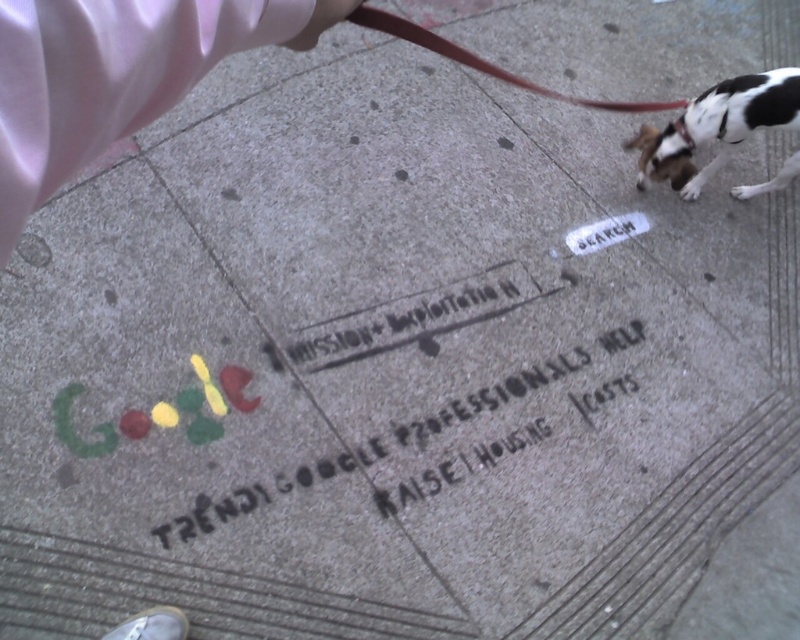
You are a photographer trying to capture the Google logo on the sidewalk. You notice a pink satin ribbon at upper left and a white and black fur dog at upper right in your frame. Which object is positioned lower in the image?

The pink satin ribbon at upper left is positioned lower than the white and black fur dog at upper right.

You are a photographer standing at the sidewalk scene. You want to take a closeup photo of the pink satin ribbon at upper left. The camera requires the subject to be at least 16 inches away to focus properly. Can you take the photo without moving closer?

The distance between the pink satin ribbon at upper left and the camera is 15.09 inches, which is less than the required 16 inches. Therefore, you cannot take the photo without moving closer to ensure proper focus.

You are a delivery robot navigating a sidewalk. You see the black stenciled text at center and the brown leather leash at upper center. Which object is located to the left of the other?

The black stenciled text at center is positioned on the left side of brown leather leash at upper center, so the black stenciled text at center is to the left of the brown leather leash at upper center.